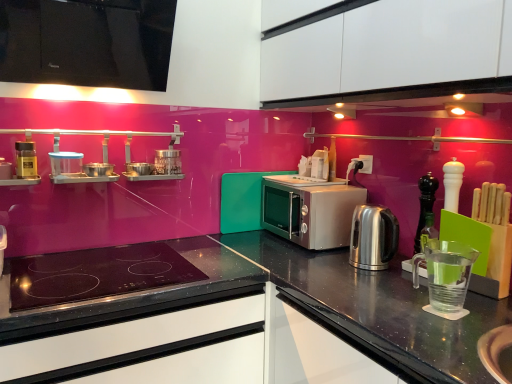
Question: Looking at their shapes, would you say black matte drawer at lower left is wider or thinner than white matte cabinet at upper center, the 2th cabinetry in the left-to-right sequence?

Choices:
 (A) wide
 (B) thin

Answer: (A)

Question: Considering the positions of point (177, 322) and point (266, 81), is point (177, 322) closer or farther from the camera than point (266, 81)?

Choices:
 (A) closer
 (B) farther

Answer: (A)

Question: Estimate the real-world distances between objects in this image. Which object is closer to the white matte cabinet at upper center, the first cabinetry from the right?

Choices:
 (A) satin silver microwave at center
 (B) transparent plastic measuring cup at right, which is the first appliance from bottom to top
 (C) matte black spice jar at left, the 1th appliance viewed from the top
 (D) black glass cooktop at center
 (E) black granite countertop at center

Answer: (A)

Question: Which object is the farthest from the matte black spice container at left, the 1th appliance when ordered from left to right?

Choices:
 (A) clear plastic container at upper left, acting as the second appliance starting from the top
 (B) transparent plastic measuring cup at right, which is counted as the 4th appliance, starting from the top
 (C) black glass cooktop at center
 (D) white matte cabinet at upper center, the first cabinetry from the right
 (E) matte black spice jar at left, the 1th appliance viewed from the top

Answer: (B)